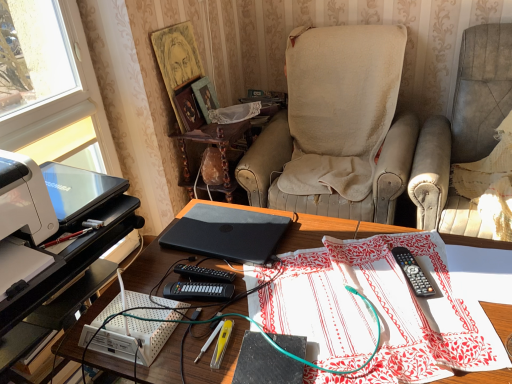
Where is `blank space situated above wooden polished side table at center (from a real-world perspective)`? The width and height of the screenshot is (512, 384). blank space situated above wooden polished side table at center (from a real-world perspective) is located at coordinates (217, 123).